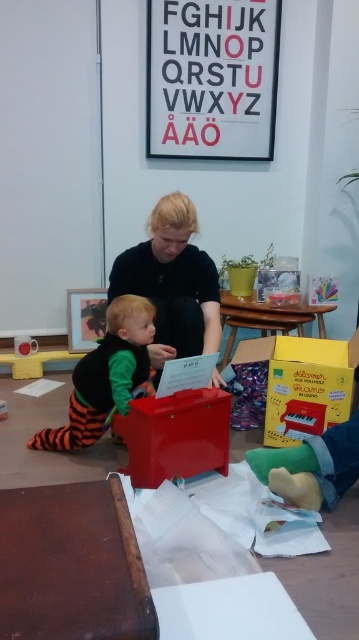
Question: Which of the following is the closest to the observer?

Choices:
 (A) yellow cardboard box at lower right
 (B) matte black sweater at center
 (C) orange striped fabric toddler at lower left
 (D) metallic red toy box at center

Answer: (D)

Question: Which of these objects is positioned closest to the metallic red toy box at center?

Choices:
 (A) orange striped fabric toddler at lower left
 (B) matte black sweater at center

Answer: (A)

Question: Does matte black sweater at center appear on the right side of yellow cardboard box at lower right?

Choices:
 (A) yes
 (B) no

Answer: (B)

Question: Is yellow cardboard box at lower right wider than metallic red toy box at center?

Choices:
 (A) no
 (B) yes

Answer: (B)

Question: Which point appears closest to the camera in this image?

Choices:
 (A) (183, 346)
 (B) (99, 420)
 (C) (143, 428)

Answer: (C)

Question: Can you confirm if metallic red toy box at center is positioned above orange striped fabric toddler at lower left?

Choices:
 (A) no
 (B) yes

Answer: (A)